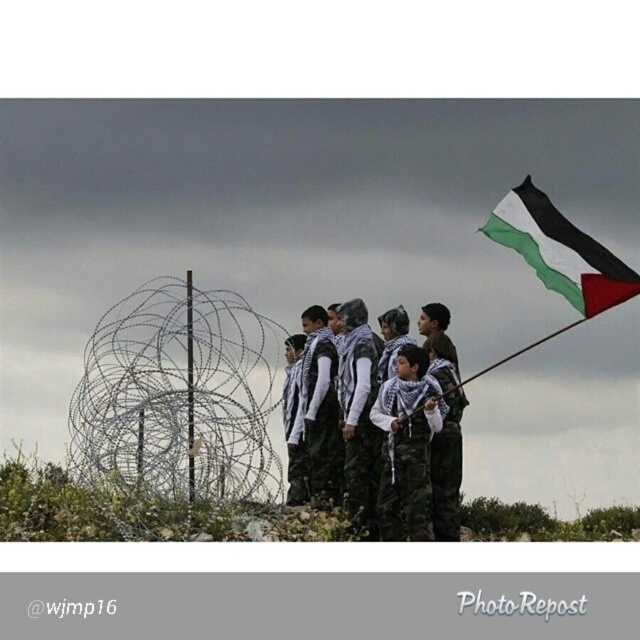
Question: Can you confirm if black and white fabric flag at upper right is smaller than white matte uniform at center?

Choices:
 (A) no
 (B) yes

Answer: (B)

Question: Can you confirm if black and white fabric flag at upper right is smaller than camouflage fabric uniform at center?

Choices:
 (A) yes
 (B) no

Answer: (A)

Question: Which is nearer to the camouflage pants at center?

Choices:
 (A) white matte uniform at center
 (B) black and white fabric flag at upper right

Answer: (A)

Question: Which point is closer to the camera?

Choices:
 (A) camouflage fabric uniform at center
 (B) black and white fabric flag at upper right

Answer: (A)

Question: Observing the image, what is the correct spatial positioning of camouflage fabric uniform at center in reference to white matte uniform at center?

Choices:
 (A) above
 (B) below

Answer: (A)

Question: Estimate the real-world distances between objects in this image. Which object is farther from the black and white fabric flag at upper right?

Choices:
 (A) camouflage fabric uniform at center
 (B) camouflage pants at center
 (C) white matte uniform at center

Answer: (C)